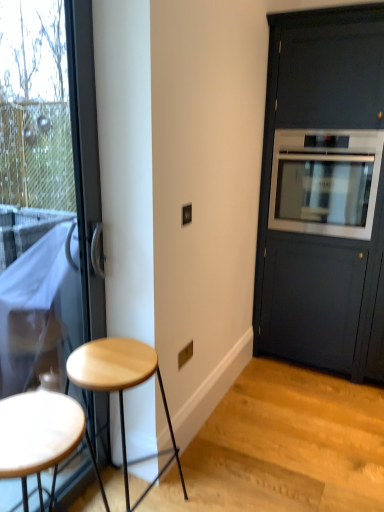
Where is `free space above wooden stool at left, marked as the first stool in a front-to-back arrangement (from a real-world perspective)`? The height and width of the screenshot is (512, 384). free space above wooden stool at left, marked as the first stool in a front-to-back arrangement (from a real-world perspective) is located at coordinates (37, 429).